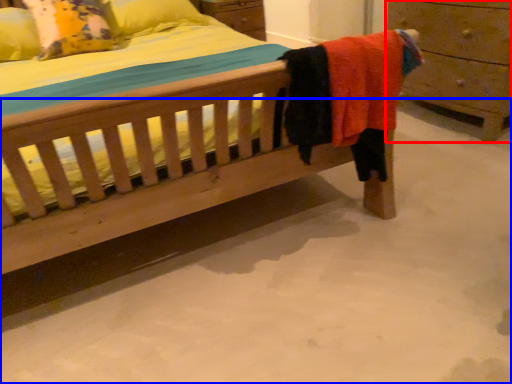
Question: Which object is closer to the camera taking this photo, chest of drawers (highlighted by a red box) or concrete (highlighted by a blue box)?

Choices:
 (A) chest of drawers
 (B) concrete

Answer: (B)